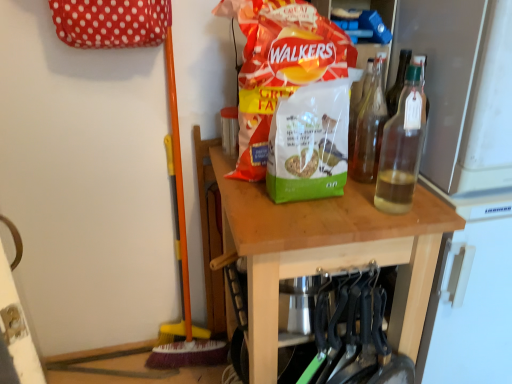
Locate an element on the screen. Image resolution: width=512 pixels, height=384 pixels. vacant area that lies between clear glass bottle at upper right, which is counted as the second bottle, starting from the back, and green matte birdseed bag at center, which is the second waste in top-to-bottom order is located at coordinates (349, 204).